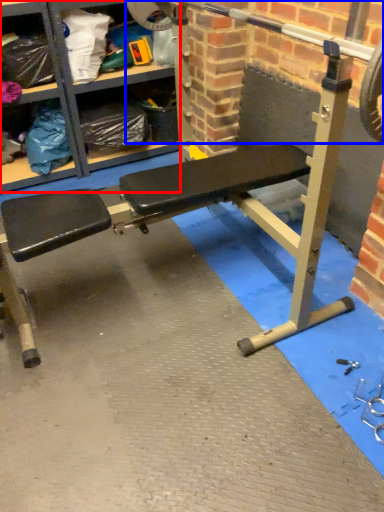
Question: Which object is further to the camera taking this photo, shelf (highlighted by a red box) or barbell (highlighted by a blue box)?

Choices:
 (A) shelf
 (B) barbell

Answer: (A)